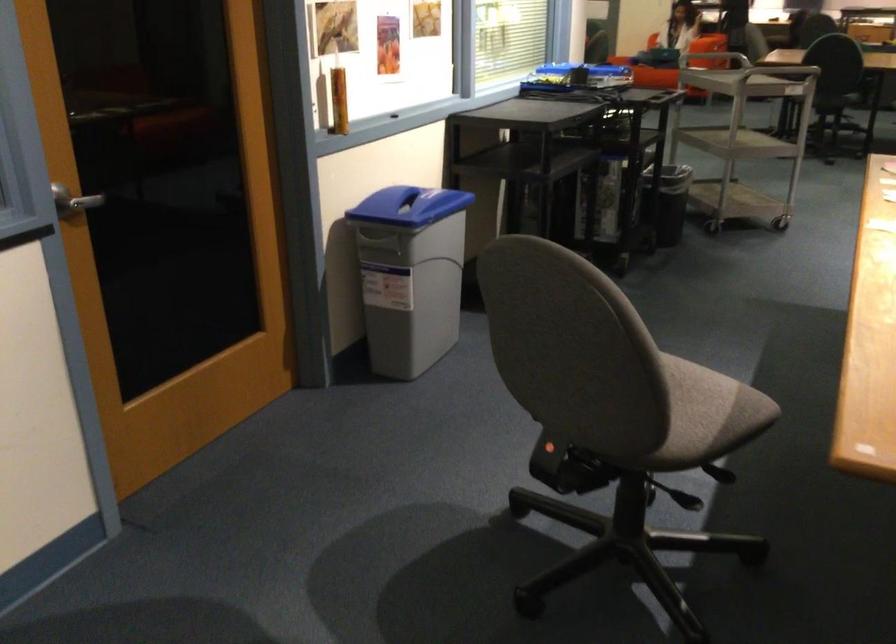
Image resolution: width=896 pixels, height=644 pixels. Find the location of `orange sofa sitting surface`. orange sofa sitting surface is located at coordinates (709, 53).